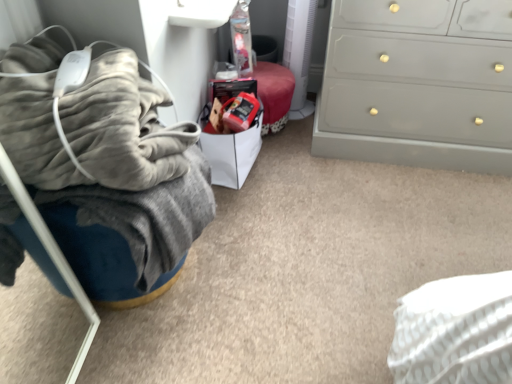
Describe the element at coordinates (232, 153) in the screenshot. Image resolution: width=512 pixels, height=384 pixels. I see `white paper bag at center` at that location.

Find the location of a particular element. velvety gray blanket at left is located at coordinates (93, 129).

Find the location of a particular element. The width and height of the screenshot is (512, 384). matte gray dresser at right is located at coordinates (418, 84).

Could velvety gray blanket at left be considered to be inside white paper bag at center?

No, velvety gray blanket at left is not surrounded by white paper bag at center.

Identify the location of blanket that appears below the white paper bag at center (from the image's perspective). (93, 129).

Considering the positions of points (222, 157) and (26, 67), is point (222, 157) farther from camera compared to point (26, 67)?

Yes, point (222, 157) is farther from viewer.

Considering the relative sizes of white paper bag at center and velvety gray blanket at left in the image provided, is white paper bag at center taller than velvety gray blanket at left?

Yes.

Image resolution: width=512 pixels, height=384 pixels. In order to click on blanket below the white paper bag at center (from the image's perspective) in this screenshot , I will do `click(93, 129)`.

Is velvety gray blanket at left directly adjacent to white paper bag at center?

No, velvety gray blanket at left is not beside white paper bag at center.

Measure the distance from velvety gray blanket at left to white paper bag at center.

velvety gray blanket at left and white paper bag at center are 22.97 inches apart from each other.

From the image's perspective, which one is positioned lower, velvety gray blanket at left or white paper bag at center?

velvety gray blanket at left.

Is point (489, 95) farther from viewer compared to point (225, 183)?

No, (489, 95) is closer to viewer.

Who is smaller, matte gray dresser at right or white paper bag at center?

white paper bag at center.

Between matte gray dresser at right and white paper bag at center, which one has less height?

Standing shorter between the two is white paper bag at center.

Would you say matte gray dresser at right is a long distance from white paper bag at center?

No, matte gray dresser at right is in close proximity to white paper bag at center.

From the image's perspective, which one is positioned lower, matte gray dresser at right or velvety gray blanket at left?

velvety gray blanket at left.

From a real-world perspective, which object rests below the other?

matte gray dresser at right is physically lower.

Is matte gray dresser at right taller than velvety gray blanket at left?

Indeed, matte gray dresser at right has a greater height compared to velvety gray blanket at left.

From a real-world perspective, is velvety gray blanket at left above or below matte gray dresser at right?

Clearly, from a real-world perspective, velvety gray blanket at left is above matte gray dresser at right.

Is velvety gray blanket at left positioned in front of matte gray dresser at right?

Yes, velvety gray blanket at left is closer to the viewer.

Considering the sizes of objects velvety gray blanket at left and matte gray dresser at right in the image provided, who is taller, velvety gray blanket at left or matte gray dresser at right?

matte gray dresser at right is taller.

Which object is wider, white paper bag at center or matte gray dresser at right?

matte gray dresser at right is wider.

How much distance is there between white paper bag at center and matte gray dresser at right?

A distance of 22.54 inches exists between white paper bag at center and matte gray dresser at right.

Does white paper bag at center have a smaller size compared to matte gray dresser at right?

Indeed, white paper bag at center has a smaller size compared to matte gray dresser at right.

What's the angular difference between white paper bag at center and matte gray dresser at right's facing directions?

The angular difference between white paper bag at center and matte gray dresser at right is 90.3 degrees.

Find the location of a particular element. Image resolution: width=512 pixels, height=384 pixels. drawer located above the velvety gray blanket at left (from the image's perspective) is located at coordinates (232, 153).

You are a GUI agent. You are given a task and a screenshot of the screen. Output one action in this format:
    pyautogui.click(x=<x>, y=<y>)
    Task: Click on the drawer lying behind the velvety gray blanket at left
    This screenshot has height=384, width=512.
    Given the screenshot: What is the action you would take?
    pyautogui.click(x=232, y=153)

Estimate the real-world distances between objects in this image. Which object is further from matte gray dresser at right, white paper bag at center or velvety gray blanket at left?

The object further to matte gray dresser at right is velvety gray blanket at left.

From the image, which object appears to be nearer to white paper bag at center, velvety gray blanket at left or matte gray dresser at right?

matte gray dresser at right is positioned closer to the anchor white paper bag at center.

Considering their positions, is matte gray dresser at right positioned closer to white paper bag at center than velvety gray blanket at left?

The object closer to white paper bag at center is matte gray dresser at right.

From the image, which object appears to be farther from matte gray dresser at right, velvety gray blanket at left or white paper bag at center?

velvety gray blanket at left is further to matte gray dresser at right.

Based on their spatial positions, is white paper bag at center or matte gray dresser at right further from velvety gray blanket at left?

Among the two, matte gray dresser at right is located further to velvety gray blanket at left.

From the picture: Which object lies nearer to the anchor point velvety gray blanket at left, matte gray dresser at right or white paper bag at center?

Based on the image, white paper bag at center appears to be nearer to velvety gray blanket at left.

The height and width of the screenshot is (384, 512). I want to click on drawer located between velvety gray blanket at left and matte gray dresser at right in the left-right direction, so click(232, 153).